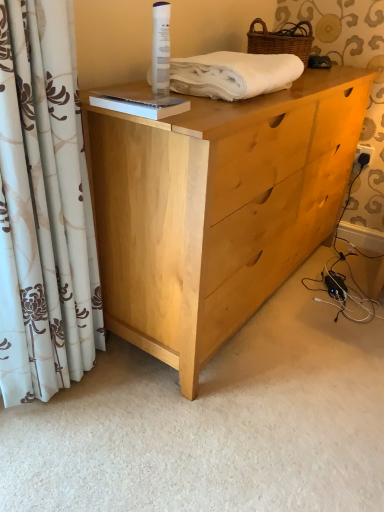
Where is `light wood dresser at center`? This screenshot has width=384, height=512. light wood dresser at center is located at coordinates (216, 208).

This screenshot has width=384, height=512. Describe the element at coordinates (44, 208) in the screenshot. I see `white floral curtain at left` at that location.

The image size is (384, 512). What do you see at coordinates (281, 40) in the screenshot? I see `woven brown basket at upper right` at bounding box center [281, 40].

You are a GUI agent. You are given a task and a screenshot of the screen. Output one action in this format:
    pyautogui.click(x=<x>, y=<y>)
    Task: Click on the light wood dresser at center
    
    Given the screenshot: What is the action you would take?
    216,208

Which of these two, white floral curtain at left or white cotton towel at upper center, is thinner?

With smaller width is white floral curtain at left.

Which object is further away from the camera, white floral curtain at left or white cotton towel at upper center?

white cotton towel at upper center is further away from the camera.

Is point (48, 92) positioned behind point (278, 83)?

No, it is in front of (278, 83).

Is white floral curtain at left positioned with its back to white cotton towel at upper center?

No.

Is light wood dresser at center shorter than white cotton towel at upper center?

Incorrect, the height of light wood dresser at center does not fall short of that of white cotton towel at upper center.

Is light wood dresser at center far from white cotton towel at upper center?

light wood dresser at center is near white cotton towel at upper center, not far away.

Is light wood dresser at center oriented away from white cotton towel at upper center?

light wood dresser at center is not turned away from white cotton towel at upper center.

Image resolution: width=384 pixels, height=512 pixels. I want to click on chest of drawers located on the right of white floral curtain at left, so click(216, 208).

Does point (121, 86) appear closer or farther from the camera than point (7, 63)?

Point (121, 86) appears to be farther away from the viewer than point (7, 63).

From a real-world perspective, which object rests below the other?

light wood dresser at center, from a real-world perspective.

Considering the sizes of objects light wood dresser at center and white floral curtain at left in the image provided, who is smaller, light wood dresser at center or white floral curtain at left?

Smaller between the two is white floral curtain at left.

Find the location of a particular element. chest of drawers to the left of woven brown basket at upper right is located at coordinates (216, 208).

Can you confirm if light wood dresser at center is thinner than woven brown basket at upper right?

Incorrect, the width of light wood dresser at center is not less than that of woven brown basket at upper right.

From the image's perspective, would you say light wood dresser at center is shown under woven brown basket at upper right?

Yes, from the image's perspective, light wood dresser at center is beneath woven brown basket at upper right.

Can you confirm if white cotton towel at upper center is thinner than light wood dresser at center?

Indeed, white cotton towel at upper center has a lesser width compared to light wood dresser at center.

In terms of height, does white cotton towel at upper center look taller or shorter compared to light wood dresser at center?

In the image, white cotton towel at upper center appears to be shorter than light wood dresser at center.

Is the position of white cotton towel at upper center less distant than that of light wood dresser at center?

No, white cotton towel at upper center is further to the viewer.

Considering the relative positions of white cotton towel at upper center and light wood dresser at center in the image provided, is white cotton towel at upper center to the left or to the right of light wood dresser at center?

From the image, it's evident that white cotton towel at upper center is to the left of light wood dresser at center.

Is woven brown basket at upper right positioned before light wood dresser at center?

No, woven brown basket at upper right is further to the viewer.

From the image's perspective, between woven brown basket at upper right and light wood dresser at center, who is located below?

From the image's view, light wood dresser at center is below.

Are woven brown basket at upper right and light wood dresser at center making contact?

woven brown basket at upper right and light wood dresser at center are not in contact.

Considering the sizes of woven brown basket at upper right and light wood dresser at center in the image, is woven brown basket at upper right wider or thinner than light wood dresser at center?

In the image, woven brown basket at upper right appears to be more narrow than light wood dresser at center.

Which of these two, white floral curtain at left or woven brown basket at upper right, is thinner?

With smaller width is white floral curtain at left.

Is white floral curtain at left oriented away from woven brown basket at upper right?

No, white floral curtain at left is not facing away from woven brown basket at upper right.

In the scene shown: Which is closer, (18, 92) or (295, 44)?

Point (18, 92).

The width and height of the screenshot is (384, 512). In order to click on curtain on the left of white cotton towel at upper center in this screenshot , I will do `click(44, 208)`.

You are a GUI agent. You are given a task and a screenshot of the screen. Output one action in this format:
    pyautogui.click(x=<x>, y=<y>)
    Task: Click on the chest of drawers on the right side of white cotton towel at upper center
    
    Given the screenshot: What is the action you would take?
    pyautogui.click(x=216, y=208)

Considering their positions, is woven brown basket at upper right positioned further to white floral curtain at left than white cotton towel at upper center?

woven brown basket at upper right is further to white floral curtain at left.

From the image, which object appears to be nearer to white floral curtain at left, white cotton towel at upper center or woven brown basket at upper right?

white cotton towel at upper center is positioned closer to the anchor white floral curtain at left.

Which object lies nearer to the anchor point white floral curtain at left, woven brown basket at upper right or light wood dresser at center?

Based on the image, light wood dresser at center appears to be nearer to white floral curtain at left.

From the image, which object appears to be nearer to white cotton towel at upper center, woven brown basket at upper right or white floral curtain at left?

Answer: The object closer to white cotton towel at upper center is woven brown basket at upper right.

Which object lies nearer to the anchor point woven brown basket at upper right, white floral curtain at left or light wood dresser at center?

Among the two, light wood dresser at center is located nearer to woven brown basket at upper right.

From the image, which object appears to be farther from light wood dresser at center, white floral curtain at left or woven brown basket at upper right?

The object further to light wood dresser at center is woven brown basket at upper right.

Estimate the real-world distances between objects in this image. Which object is closer to light wood dresser at center, white floral curtain at left or white cotton towel at upper center?

Among the two, white cotton towel at upper center is located nearer to light wood dresser at center.

Looking at the image, which one is located further to woven brown basket at upper right, white cotton towel at upper center or light wood dresser at center?

The object further to woven brown basket at upper right is light wood dresser at center.

Where is `bath towel between light wood dresser at center and woven brown basket at upper right in the front-back direction`? bath towel between light wood dresser at center and woven brown basket at upper right in the front-back direction is located at coordinates (233, 74).

Where is `the chest of drawers located between white floral curtain at left and woven brown basket at upper right in the depth direction`? The height and width of the screenshot is (512, 384). the chest of drawers located between white floral curtain at left and woven brown basket at upper right in the depth direction is located at coordinates (216, 208).

Where is `bath towel between white floral curtain at left and light wood dresser at center in the horizontal direction`? bath towel between white floral curtain at left and light wood dresser at center in the horizontal direction is located at coordinates (233, 74).

Where is `bath towel between white floral curtain at left and woven brown basket at upper right in the front-back direction`? This screenshot has height=512, width=384. bath towel between white floral curtain at left and woven brown basket at upper right in the front-back direction is located at coordinates (233, 74).